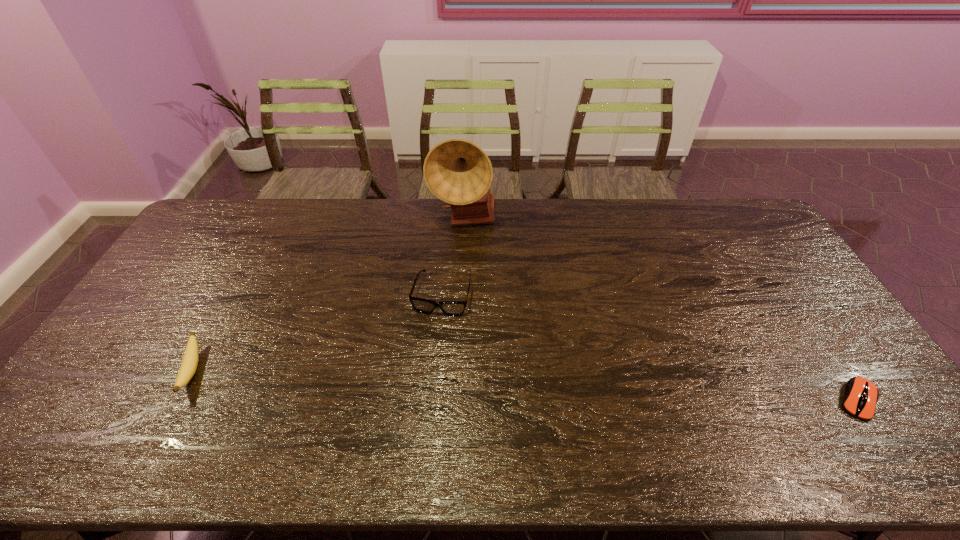
Where is `banana`? banana is located at coordinates (188, 367).

Find the location of a particular element. the leftmost object is located at coordinates (188, 367).

This screenshot has width=960, height=540. In order to click on computer mouse in this screenshot , I will do 861,395.

Identify the location of the rightmost object. Image resolution: width=960 pixels, height=540 pixels. (861, 395).

This screenshot has width=960, height=540. In order to click on the third nearest object in this screenshot , I will do `click(450, 308)`.

This screenshot has width=960, height=540. I want to click on the tallest object, so click(457, 171).

You are a GUI agent. You are given a task and a screenshot of the screen. Output one action in this format:
    pyautogui.click(x=<x>, y=<y>)
    Task: Click on the phonograph record
    
    Given the screenshot: What is the action you would take?
    pyautogui.click(x=457, y=171)

Identify the location of free space located 0.240m on the right of the banana. (291, 370).

Where is `free spot located on the left of the computer mouse`? Image resolution: width=960 pixels, height=540 pixels. free spot located on the left of the computer mouse is located at coordinates (687, 400).

Where is `vacant space located on the front-facing side of the third nearest object`? vacant space located on the front-facing side of the third nearest object is located at coordinates (414, 405).